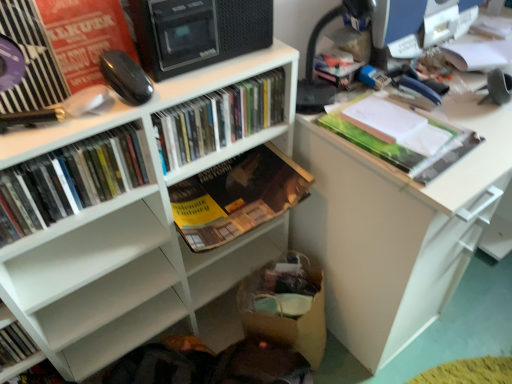
Where is `vacant space to the right of green matte folder at upper right, the 1th book positioned from the right`? The image size is (512, 384). vacant space to the right of green matte folder at upper right, the 1th book positioned from the right is located at coordinates (476, 125).